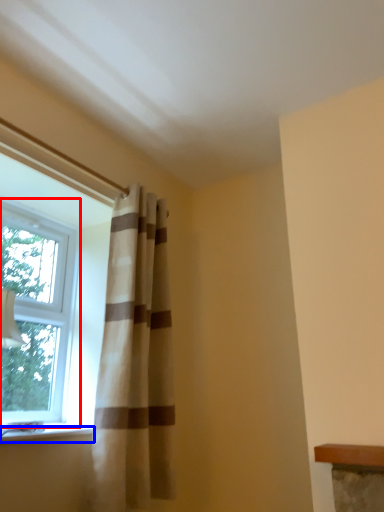
Question: Which point is closer to the camera, window (highlighted by a red box) or window sill (highlighted by a blue box)?

Choices:
 (A) window
 (B) window sill

Answer: (B)